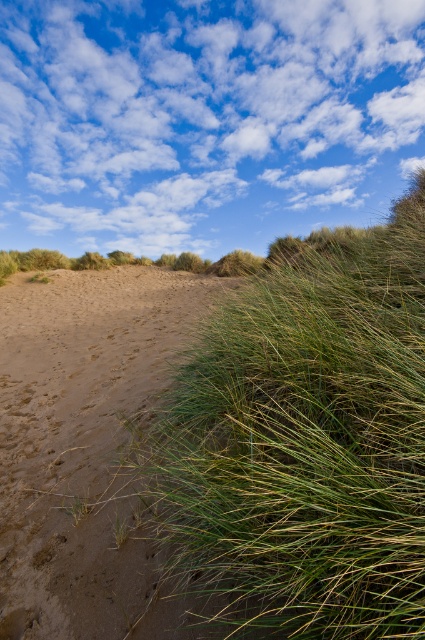
Question: Is green grassy at center positioned at the back of brown sandy at left?

Choices:
 (A) yes
 (B) no

Answer: (B)

Question: Which point is farther from the camera taking this photo?

Choices:
 (A) (234, 573)
 (B) (62, 339)

Answer: (B)

Question: Is green grassy at center bigger than brown sandy at left?

Choices:
 (A) yes
 (B) no

Answer: (B)

Question: Does green grassy at center appear under brown sandy at left?

Choices:
 (A) no
 (B) yes

Answer: (B)

Question: Among these objects, which one is nearest to the camera?

Choices:
 (A) brown sandy at left
 (B) green grassy at center

Answer: (B)